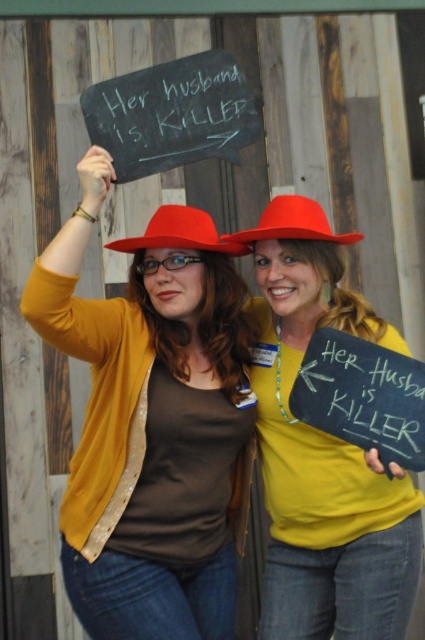
Question: In this image, where is matte yellow shirt at center located relative to matte red hat at center?

Choices:
 (A) right
 (B) left

Answer: (A)

Question: Considering the real-world distances, which object is farthest from the matte red hat at center?

Choices:
 (A) matte black hat at upper left
 (B) black chalkboard at upper center
 (C) matte yellow shirt at center

Answer: (C)

Question: Does matte yellow shirt at center appear under matte red hat at center?

Choices:
 (A) no
 (B) yes

Answer: (B)

Question: Estimate the real-world distances between objects in this image. Which object is farther from the matte red hat at center?

Choices:
 (A) black chalkboard at upper center
 (B) matte red cowboy hat at center
 (C) matte black hat at upper left
 (D) matte yellow shirt at center

Answer: (D)

Question: Does matte yellow shirt at center appear under matte red hat at center?

Choices:
 (A) yes
 (B) no

Answer: (A)

Question: Which of the following is the farthest from the observer?

Choices:
 (A) (78, 563)
 (B) (141, 113)
 (C) (283, 531)

Answer: (C)